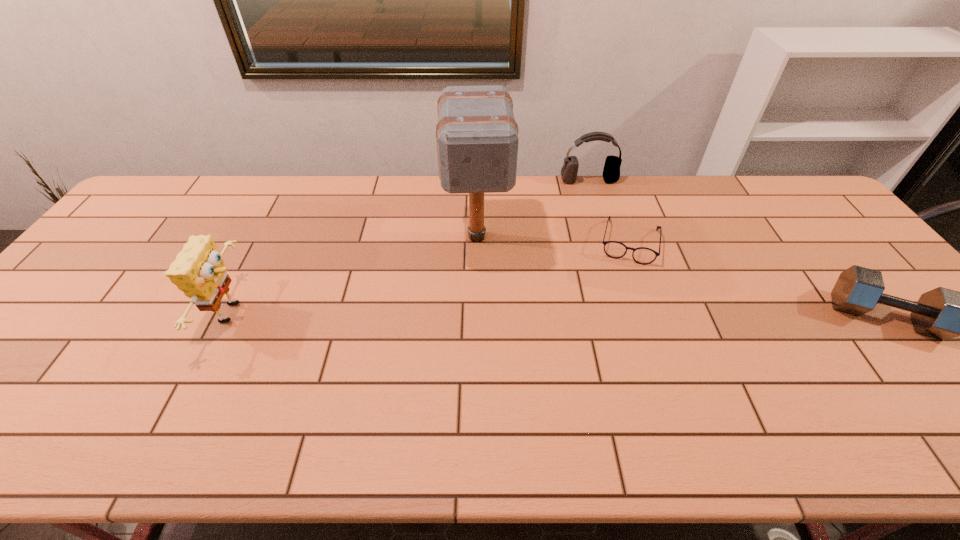
The width and height of the screenshot is (960, 540). What are the coordinates of `vacant space on the desktop that is between the leftmost object and the dumbbell and is positioned on the front-facing side of the spectacles` in the screenshot? It's located at (617, 315).

I want to click on free space on the desktop that is between the sponge and the fourth tallest object and is positioned on the headband of the farthest object, so click(633, 315).

The image size is (960, 540). I want to click on free space on the desktop that is between the leftmost object and the rightmost object and is positioned on the striking surface of the second object from left to right, so click(x=481, y=314).